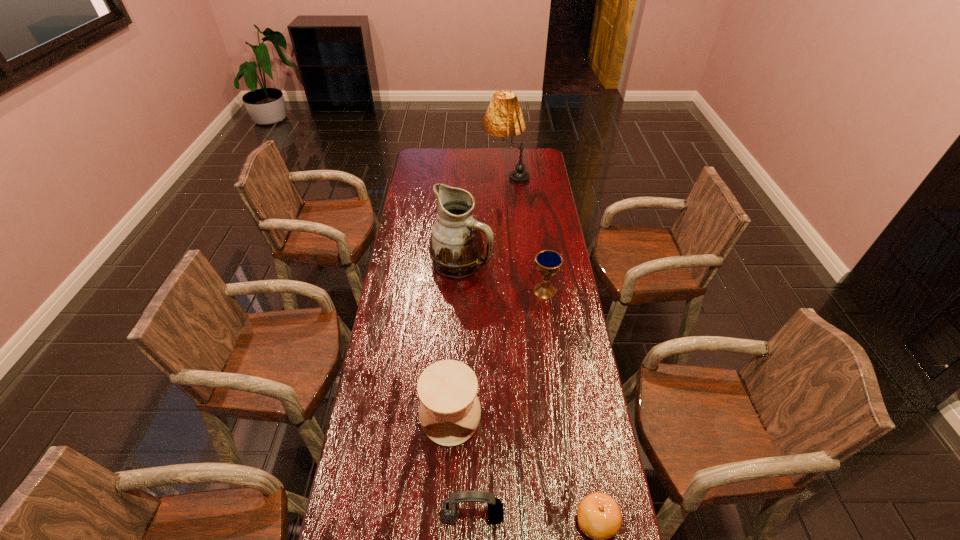
Where is `vacant space located from the spout of the fifth shortest object`? vacant space located from the spout of the fifth shortest object is located at coordinates (516, 263).

Locate an element on the screen. Image resolution: width=960 pixels, height=540 pixels. vacant position located at the open side of the pottery is located at coordinates (446, 502).

This screenshot has width=960, height=540. I want to click on vacant space located on the back of the chalice, so click(536, 226).

At what (x,y) coordinates should I click in order to perform the action: click on object that is at the far edge. Please return your answer as a coordinate pair (x, y). This screenshot has height=540, width=960. Looking at the image, I should click on (504, 118).

At what (x,y) coordinates should I click in order to perform the action: click on object present at the left edge. Please return your answer as a coordinate pair (x, y). Looking at the image, I should click on (456, 248).

Locate an element on the screen. lampshade that is at the right edge is located at coordinates (504, 118).

Locate an element on the screen. This screenshot has height=540, width=960. chalice located at the right edge is located at coordinates (548, 262).

Locate an element on the screen. object present at the far right corner is located at coordinates (504, 118).

Find the location of a particular element. This screenshot has width=960, height=540. vacant area at the far edge is located at coordinates (464, 152).

In the image, there is a desktop. At what (x,y) coordinates should I click in order to perform the action: click on free space at the left edge. Please return your answer as a coordinate pair (x, y). Looking at the image, I should click on (413, 376).